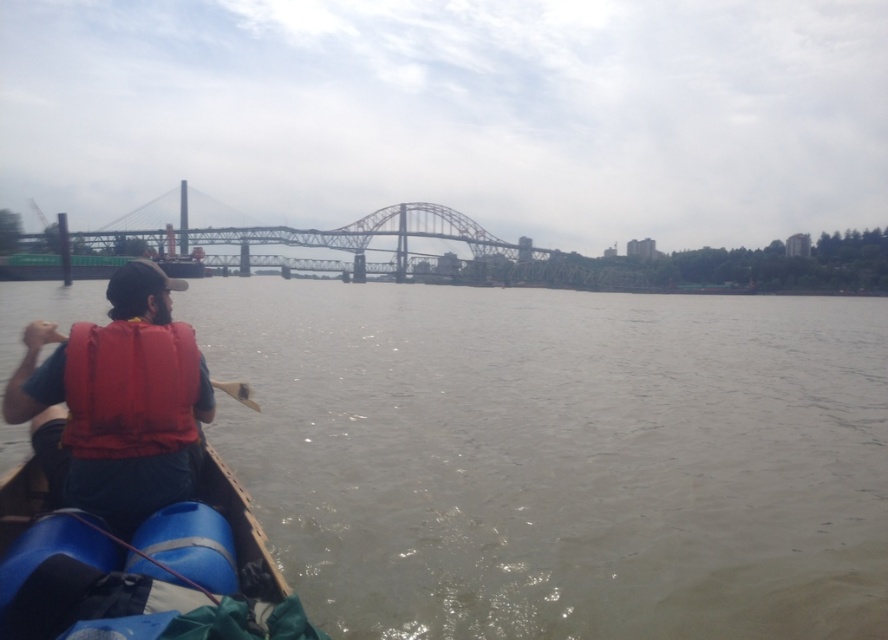
Does blue rubber boat at lower left have a greater height compared to wooden paddle at center?

Indeed, blue rubber boat at lower left has a greater height compared to wooden paddle at center.

I want to click on blue rubber boat at lower left, so click(140, 568).

Where is `blue rubber boat at lower left`? The width and height of the screenshot is (888, 640). blue rubber boat at lower left is located at coordinates (140, 568).

This screenshot has height=640, width=888. Find the location of `blue rubber boat at lower left`. blue rubber boat at lower left is located at coordinates (140, 568).

Consider the image. Can you confirm if matte orange life vest at lower left is positioned above red matte life jacket at left?

Correct, matte orange life vest at lower left is located above red matte life jacket at left.

Does matte orange life vest at lower left have a smaller size compared to red matte life jacket at left?

Actually, matte orange life vest at lower left might be larger than red matte life jacket at left.

Where is `matte orange life vest at lower left`? matte orange life vest at lower left is located at coordinates (117, 401).

The height and width of the screenshot is (640, 888). In order to click on matte orange life vest at lower left in this screenshot , I will do `click(117, 401)`.

Does blue rubber boat at lower left have a larger size compared to matte orange life vest at lower left?

No.

Is point (207, 525) positioned behind point (25, 362)?

No, (207, 525) is in front of (25, 362).

You are a GUI agent. You are given a task and a screenshot of the screen. Output one action in this format:
    pyautogui.click(x=<x>, y=<y>)
    Task: Click on the blue rubber boat at lower left
    
    Given the screenshot: What is the action you would take?
    click(140, 568)